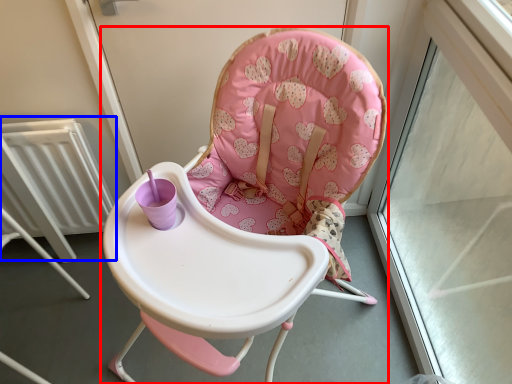
Question: Among these objects, which one is nearest to the camera, chair (highlighted by a red box) or radiator (highlighted by a blue box)?

Choices:
 (A) chair
 (B) radiator

Answer: (A)